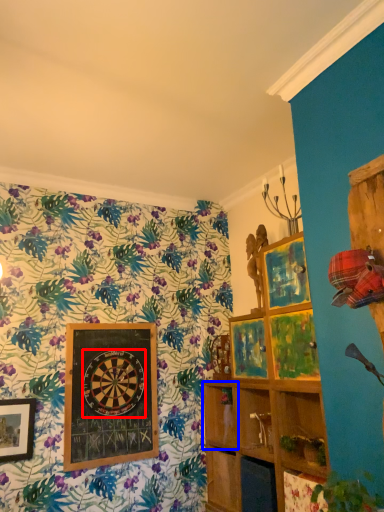
Question: Which of the following is the closest to the observer, design (highlighted by a red box) or shelf (highlighted by a blue box)?

Choices:
 (A) design
 (B) shelf

Answer: (A)